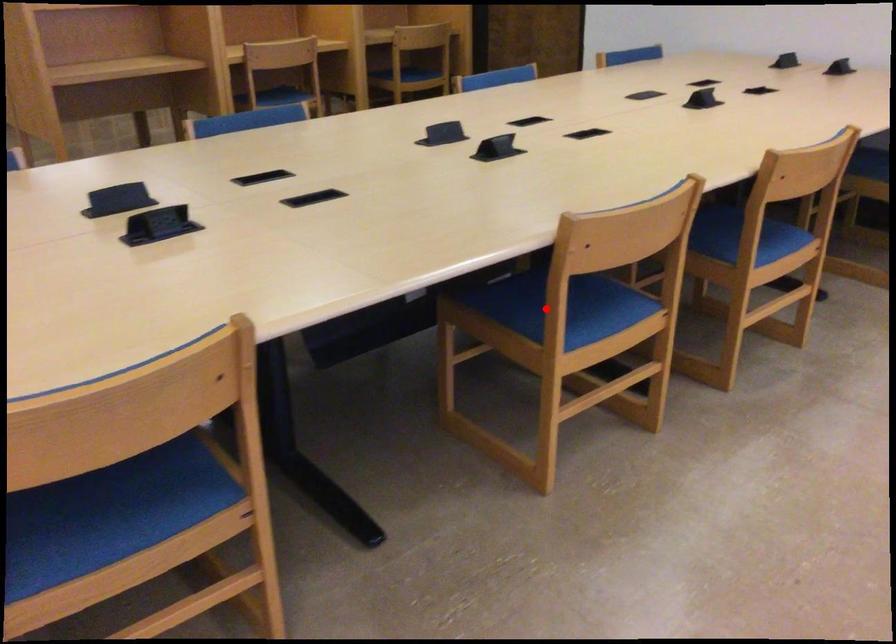
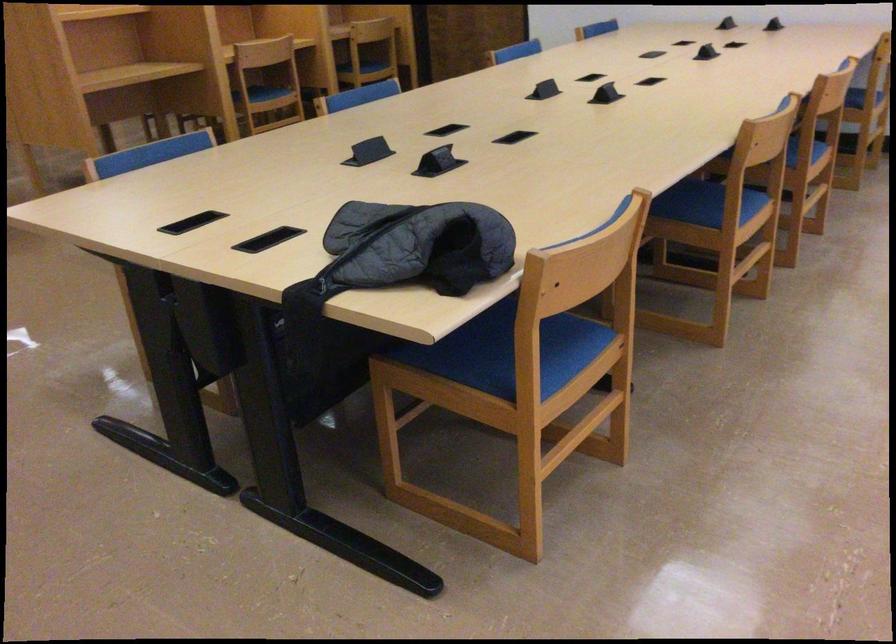
Find the pixel in the second image that matches the highlighted location in the first image.

(702, 204)